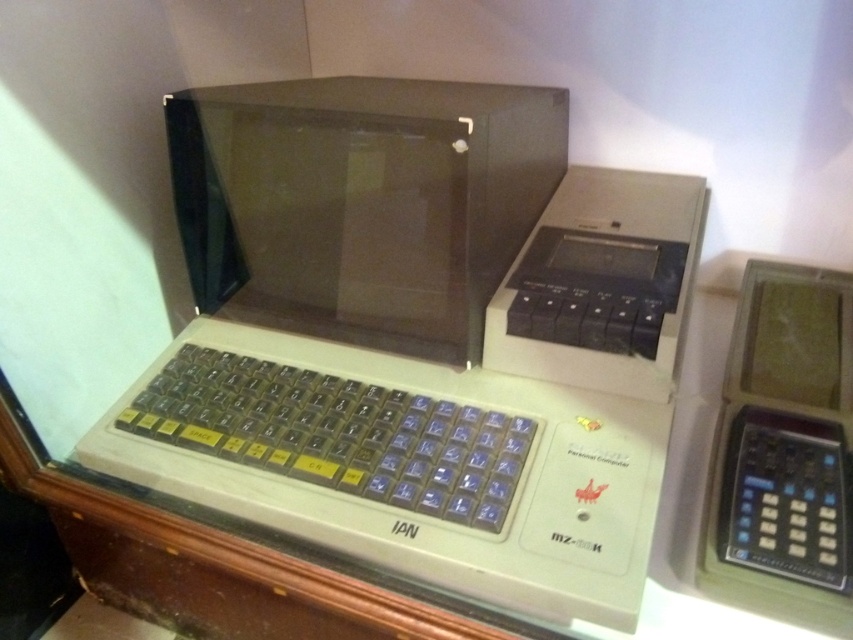
In the scene shown: You are a museum guide explaining the vintage computer setup. A visitor asks if they can place a 12 inch ruler between the green plastic calculator at right and the clear plastic keyboard at center without touching either. What do you tell them?

The distance between the green plastic calculator at right and the clear plastic keyboard at center is 11.54 inches, which is slightly less than 12 inches. Therefore, a 12 inch ruler placed between them would touch one or both objects.

You are a museum visitor looking at the vintage computer setup. You notice the green plastic calculator at right and the clear plastic keyboard at center. Which object is closer to you as you stand in front of the glass case?

The green plastic calculator at right is closer to you because it is in front of the clear plastic keyboard at center.